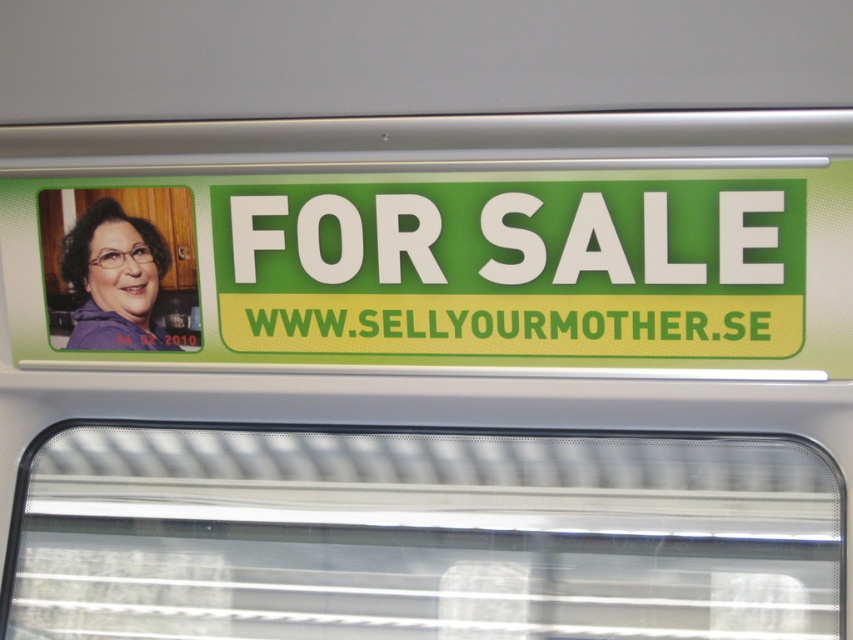
Question: Does transparent plastic window at center have a smaller size compared to green/yellow plastic sign at center?

Choices:
 (A) yes
 (B) no

Answer: (B)

Question: Among these points, which one is farthest from the camera?

Choices:
 (A) (149, 289)
 (B) (426, 260)

Answer: (A)

Question: Among these objects, which one is nearest to the camera?

Choices:
 (A) green/yellow plastic sign at center
 (B) matte purple shirt at left
 (C) transparent plastic window at center

Answer: (A)

Question: Does transparent plastic window at center appear over green/yellow plastic sign at center?

Choices:
 (A) no
 (B) yes

Answer: (A)

Question: Can you confirm if transparent plastic window at center is bigger than matte purple shirt at left?

Choices:
 (A) yes
 (B) no

Answer: (A)

Question: Which point is farther to the camera?

Choices:
 (A) green/yellow plastic sign at center
 (B) transparent plastic window at center
 (C) matte purple shirt at left

Answer: (C)